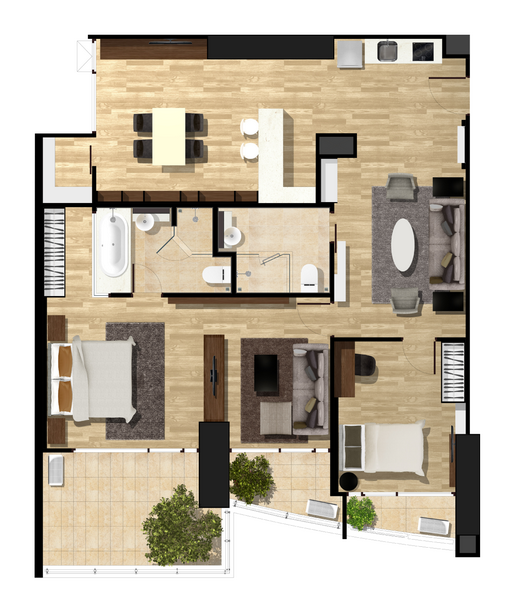
Locate an element on the screen. tub is located at coordinates (118, 246).